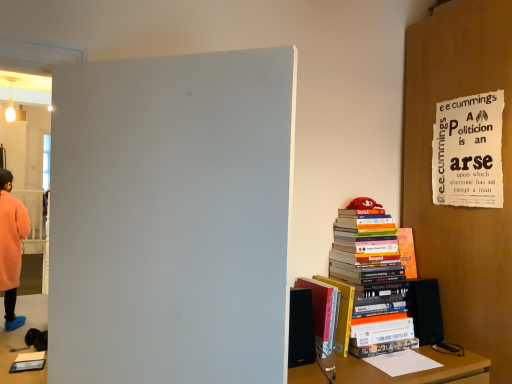
Question: Is hardcover book at right, which appears as the 2th book when viewed from the right, not inside hardcover books at right, which is the second book from left to right?

Choices:
 (A) yes
 (B) no

Answer: (A)

Question: Is hardcover books at right, the 1th book from the right, at the back of hardcover book at right, which appears as the 2th book when viewed from the right?

Choices:
 (A) no
 (B) yes

Answer: (A)

Question: Is the depth of hardcover book at right, placed as the first book when sorted from left to right, less than that of hardcover books at right, which is the second book from left to right?

Choices:
 (A) no
 (B) yes

Answer: (B)

Question: From the image's perspective, is hardcover book at right, which appears as the 2th book when viewed from the right, located above hardcover books at right, which is the second book from left to right?

Choices:
 (A) no
 (B) yes

Answer: (A)

Question: Can you confirm if hardcover book at right, placed as the first book when sorted from left to right, is taller than hardcover books at right, which is the second book from left to right?

Choices:
 (A) yes
 (B) no

Answer: (B)

Question: Considering the relative sizes of hardcover book at right, which appears as the 2th book when viewed from the right, and hardcover books at right, the 1th book from the right, in the image provided, is hardcover book at right, which appears as the 2th book when viewed from the right, smaller than hardcover books at right, the 1th book from the right,?

Choices:
 (A) no
 (B) yes

Answer: (B)

Question: Can you confirm if fluffy pink coat at left is taller than hardcover book at right, placed as the first book when sorted from left to right?

Choices:
 (A) no
 (B) yes

Answer: (B)

Question: From the image's perspective, is fluffy pink coat at left over hardcover book at right, which appears as the 2th book when viewed from the right?

Choices:
 (A) yes
 (B) no

Answer: (A)

Question: Considering the relative sizes of fluffy pink coat at left and hardcover book at right, placed as the first book when sorted from left to right, in the image provided, is fluffy pink coat at left shorter than hardcover book at right, placed as the first book when sorted from left to right,?

Choices:
 (A) no
 (B) yes

Answer: (A)

Question: Is fluffy pink coat at left facing away from hardcover book at right, placed as the first book when sorted from left to right?

Choices:
 (A) no
 (B) yes

Answer: (A)

Question: Can you confirm if fluffy pink coat at left is bigger than hardcover book at right, placed as the first book when sorted from left to right?

Choices:
 (A) yes
 (B) no

Answer: (A)

Question: Considering the relative positions of fluffy pink coat at left and hardcover book at right, placed as the first book when sorted from left to right, in the image provided, is fluffy pink coat at left to the left of hardcover book at right, placed as the first book when sorted from left to right, from the viewer's perspective?

Choices:
 (A) yes
 (B) no

Answer: (A)

Question: Can you confirm if hardcover book at right, which appears as the 2th book when viewed from the right, is positioned to the left of ripped paper poster at upper right?

Choices:
 (A) no
 (B) yes

Answer: (B)